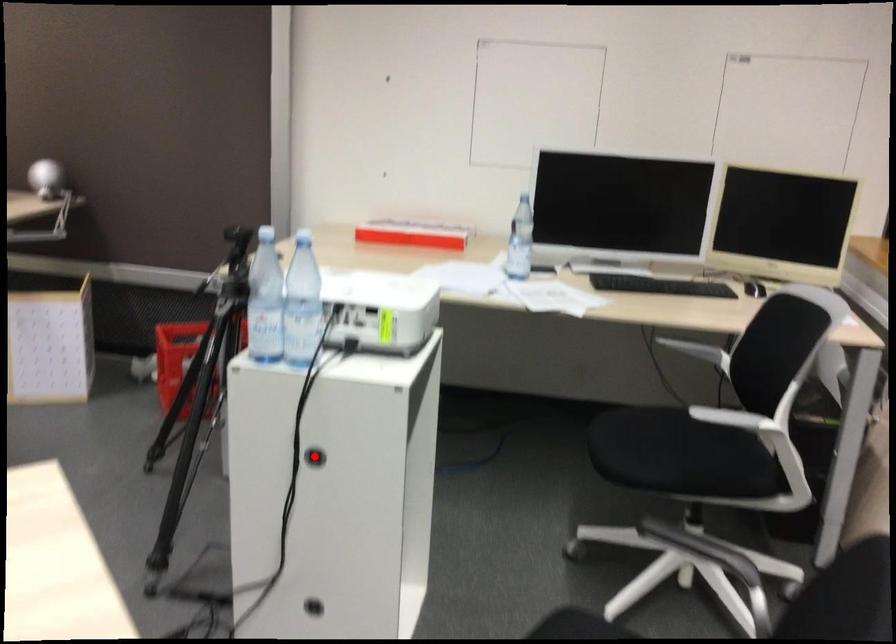
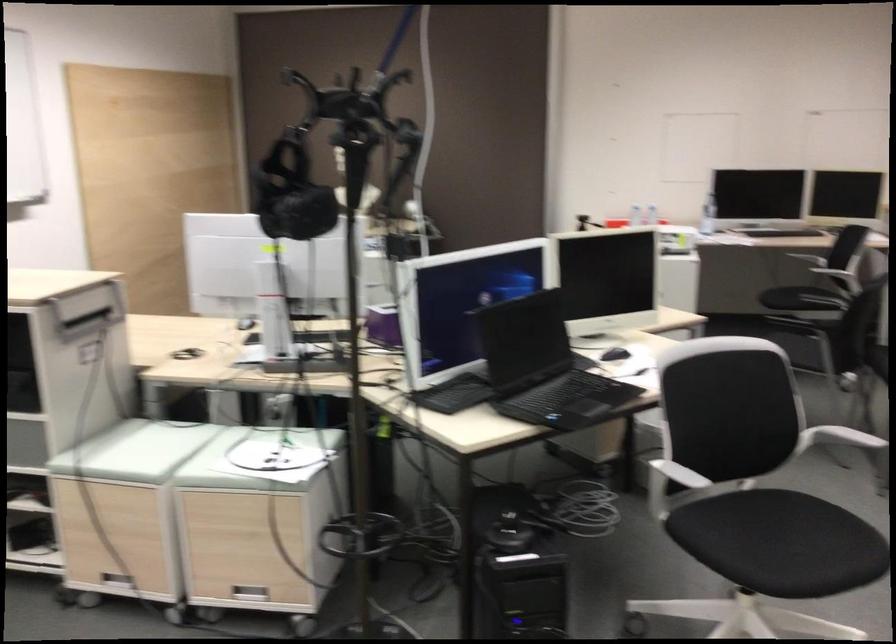
Question: I am providing you with two images of the same scene from different viewpoints. A red point is marked on the first image. Is the red point's position out of view in image 2?

Choices:
 (A) Yes
 (B) No

Answer: (A)